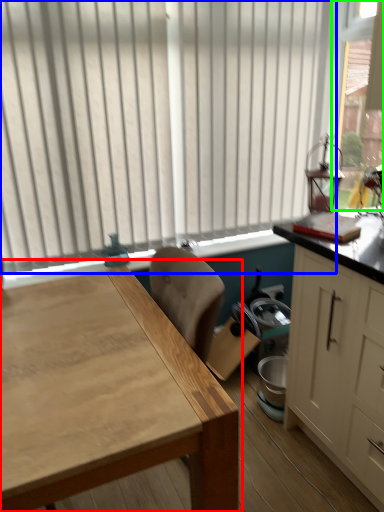
Question: Estimate the real-world distances between objects in this image. Which object is farther from table (highlighted by a red box), window (highlighted by a blue box) or window screen (highlighted by a green box)?

Choices:
 (A) window
 (B) window screen

Answer: (B)